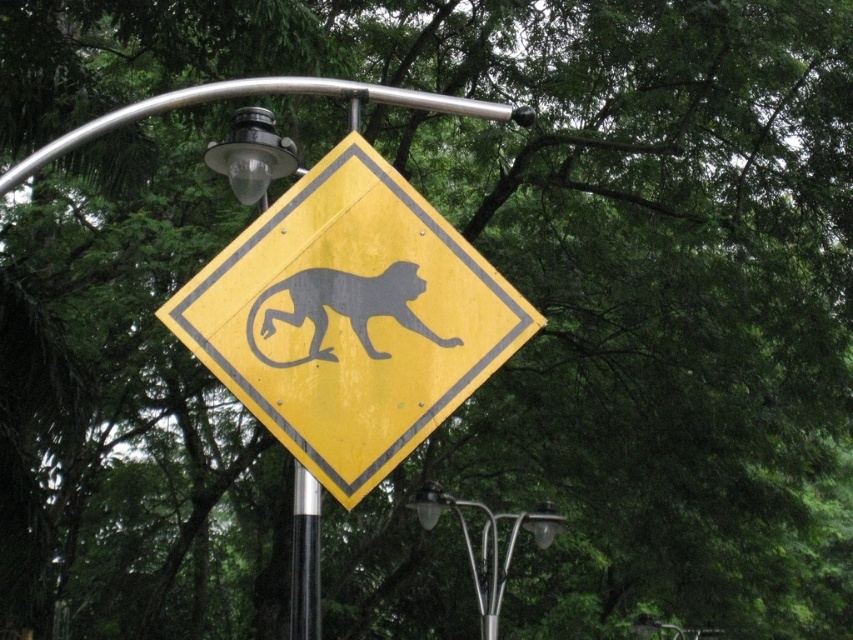
Does yellow reflective diamond at center appear under gray matte/soft plastic monkey at center?

Yes.

Is point (393, 173) farther from viewer compared to point (287, 364)?

Yes.

You are a GUI agent. You are given a task and a screenshot of the screen. Output one action in this format:
    pyautogui.click(x=<x>, y=<y>)
    Task: Click on the yellow reflective diamond at center
    This screenshot has width=853, height=640.
    Given the screenshot: What is the action you would take?
    pyautogui.click(x=350, y=317)

What do you see at coordinates (350, 317) in the screenshot?
I see `yellow reflective diamond at center` at bounding box center [350, 317].

Is yellow reflective diamond at center closer to camera compared to black glossy pole at center?

Yes, it is.

Does point (216, 340) come closer to viewer compared to point (303, 611)?

Yes, it is.

Find the location of a particular element. yellow reflective diamond at center is located at coordinates (350, 317).

Which of these two, yellow reflective diamond at center or metallic glass street light at upper center, stands taller?

Standing taller between the two is yellow reflective diamond at center.

Is point (247, 284) more distant than point (312, 483)?

No, it is in front of (312, 483).

Where is `yellow reflective diamond at center`? yellow reflective diamond at center is located at coordinates (350, 317).